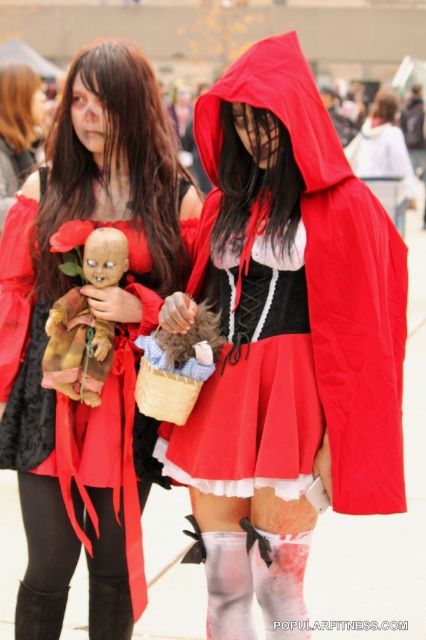
Question: Which point is closer to the camera?

Choices:
 (A) matte red cape at center
 (B) matte red coat at center
 (C) distressed brown doll at center
 (D) matte black wig at upper left

Answer: (A)

Question: Estimate the real-world distances between objects in this image. Which object is farther from the matte black wig at upper left?

Choices:
 (A) matte red cape at center
 (B) matte red coat at center
 (C) matte black dress at center

Answer: (B)

Question: Which point is closer to the camera taking this photo?

Choices:
 (A) (285, 502)
 (B) (14, 179)
 (C) (89, 180)

Answer: (A)

Question: Is matte red cape at center thinner than matte black wig at upper left?

Choices:
 (A) no
 (B) yes

Answer: (A)

Question: Is matte red cape at center smaller than matte black dress at center?

Choices:
 (A) yes
 (B) no

Answer: (B)

Question: Does matte black dress at center have a smaller size compared to distressed brown doll at center?

Choices:
 (A) no
 (B) yes

Answer: (A)